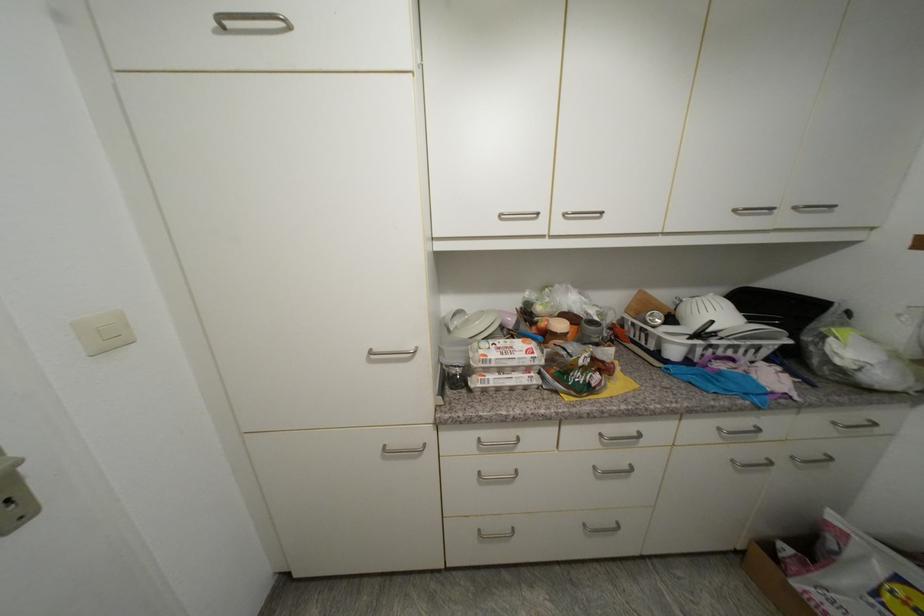
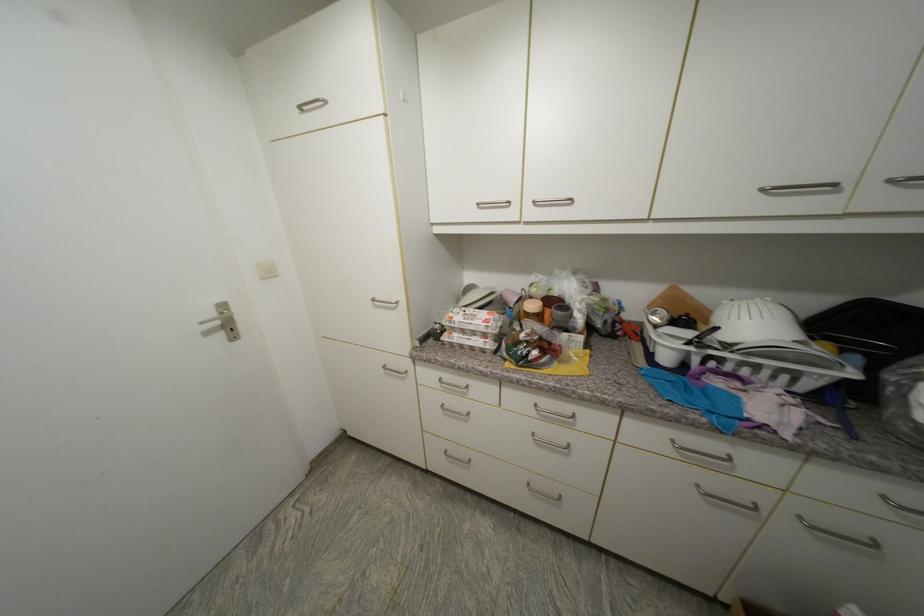
Where in the second image is the point corresponding to point 492,357 from the first image?

(457, 318)